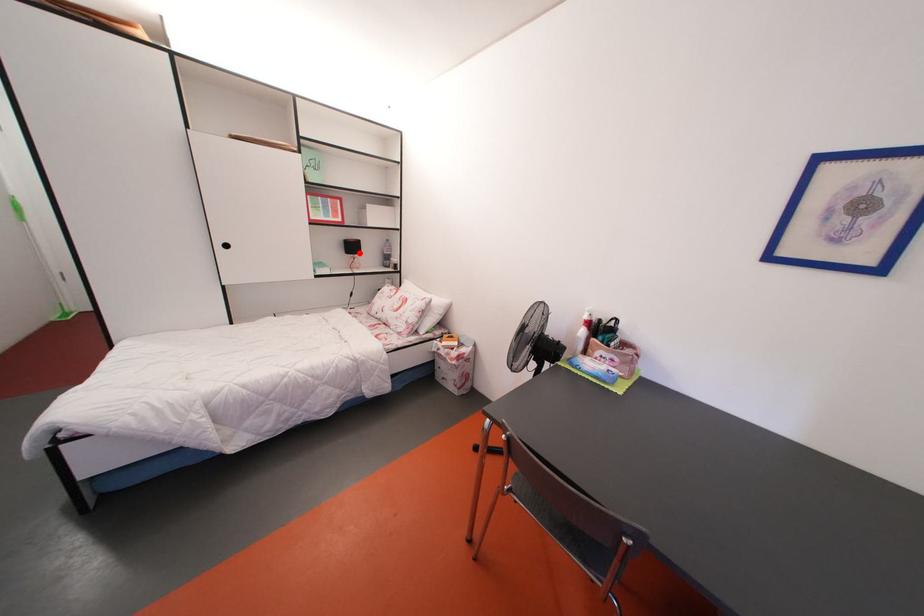
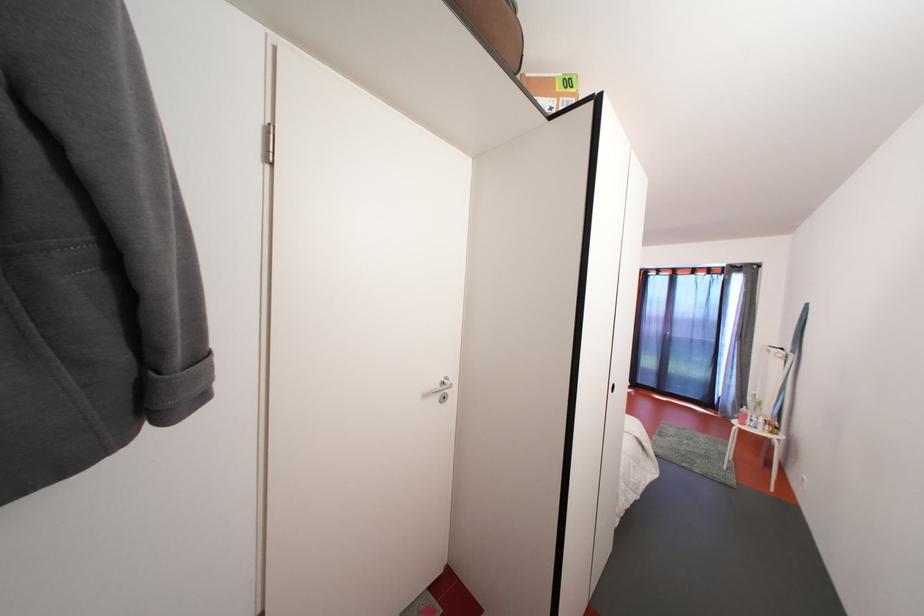
Question: I am providing you with two images of the same scene from different viewpoints. A red point is marked on the first image. Can you still see the location of the red point in image 2?

Choices:
 (A) Yes
 (B) No

Answer: (B)